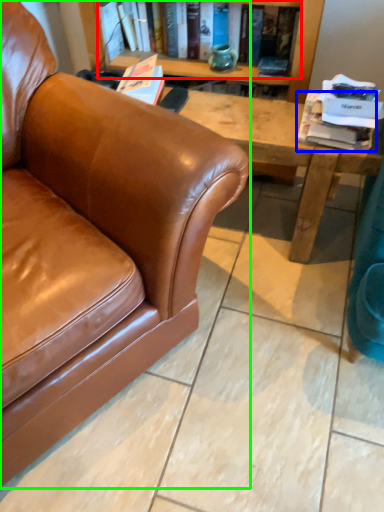
Question: Based on their relative distances, which object is farther from book (highlighted by a red box)? Choose from book (highlighted by a blue box) and studio couch (highlighted by a green box).

Choices:
 (A) book
 (B) studio couch

Answer: (B)